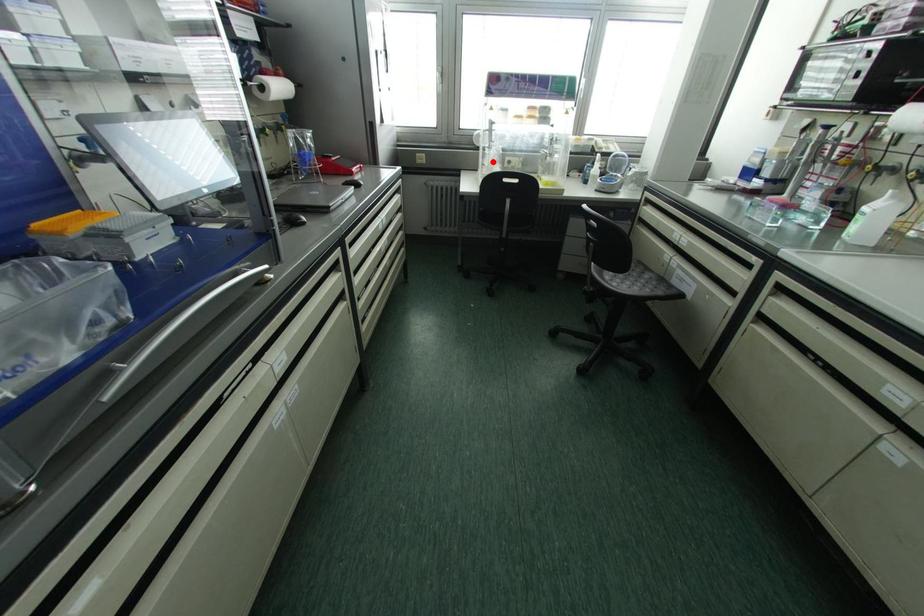
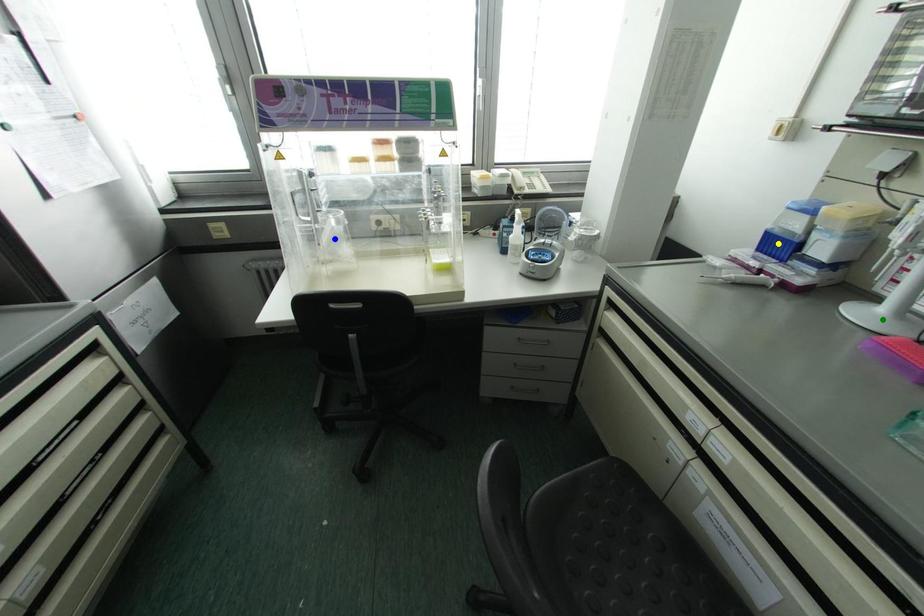
Question: I am providing you with two images of the same scene from different viewpoints. A red point is marked on the first image. You are given multiple points on the second image. Which spot in image 2 lines up with the point in image 1?

Choices:
 (A) blue point
 (B) green point
 (C) yellow point

Answer: (A)